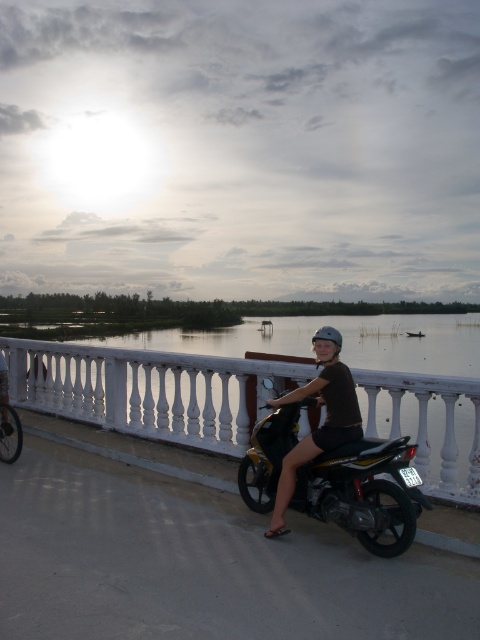
Question: Which object appears closest to the camera in this image?

Choices:
 (A) white balustrade at center
 (B) metallic silver bicycle at center
 (C) shiny metallic motorcycle at center
 (D) matte black helmet at upper center

Answer: (C)

Question: Does white balustrade at center appear on the left side of metallic silver bicycle at center?

Choices:
 (A) yes
 (B) no

Answer: (B)

Question: Is shiny metallic motorcycle at center positioned at the back of matte black helmet at upper center?

Choices:
 (A) no
 (B) yes

Answer: (A)

Question: Based on their relative distances, which object is nearer to the matte black helmet at upper center?

Choices:
 (A) shiny metallic motorcycle at center
 (B) metallic silver bicycle at center
 (C) white balustrade at center

Answer: (A)

Question: Which of these objects is positioned closest to the metallic silver bicycle at center?

Choices:
 (A) white balustrade at center
 (B) shiny metallic motorcycle at center

Answer: (B)

Question: Where is matte black helmet at upper center located in relation to metallic silver bicycle at center in the image?

Choices:
 (A) right
 (B) left

Answer: (A)